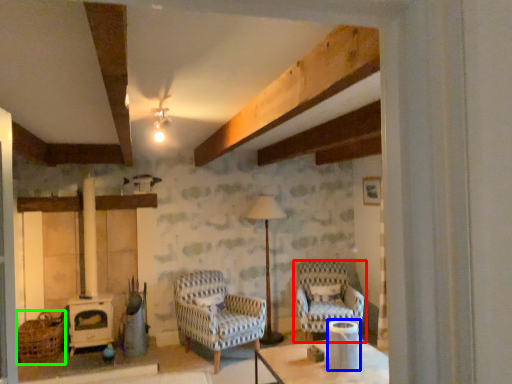
Question: Estimate the real-world distances between objects in this image. Which object is farther from chair (highlighted by a red box), appliance (highlighted by a blue box) or basket (highlighted by a green box)?

Choices:
 (A) appliance
 (B) basket

Answer: (B)